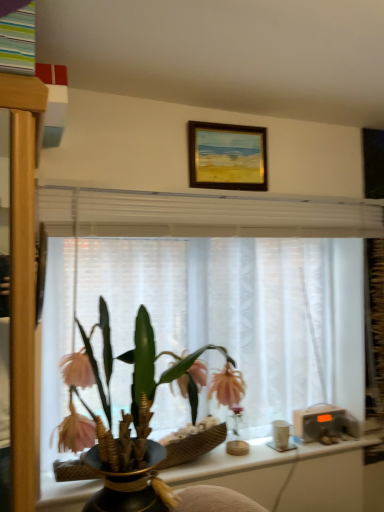
Question: Considering the relative sizes of white matte cup at right and white sheer curtain at center in the image provided, is white matte cup at right smaller than white sheer curtain at center?

Choices:
 (A) yes
 (B) no

Answer: (A)

Question: Could you tell me if white matte cup at right is turned towards white sheer curtain at center?

Choices:
 (A) no
 (B) yes

Answer: (A)

Question: Would you say white matte cup at right is outside white sheer curtain at center?

Choices:
 (A) yes
 (B) no

Answer: (A)

Question: From a real-world perspective, does white matte cup at right stand above white sheer curtain at center?

Choices:
 (A) no
 (B) yes

Answer: (A)

Question: Can you confirm if white matte cup at right is positioned to the left of white sheer curtain at center?

Choices:
 (A) yes
 (B) no

Answer: (B)

Question: Based on their positions, is transparent glass vase at center located to the left or right of matte black vase at center?

Choices:
 (A) left
 (B) right

Answer: (B)

Question: Is transparent glass vase at center spatially inside matte black vase at center, or outside of it?

Choices:
 (A) inside
 (B) outside

Answer: (B)

Question: Considering the positions of transparent glass vase at center and matte black vase at center in the image, is transparent glass vase at center wider or thinner than matte black vase at center?

Choices:
 (A) thin
 (B) wide

Answer: (A)

Question: Relative to matte black vase at center, is transparent glass vase at center in front or behind?

Choices:
 (A) front
 (B) behind

Answer: (B)

Question: Is point (188, 132) positioned closer to the camera than point (284, 438)?

Choices:
 (A) farther
 (B) closer

Answer: (B)

Question: Is gold-framed painting at upper center wider or thinner than white matte cup at right?

Choices:
 (A) thin
 (B) wide

Answer: (A)

Question: Is gold-framed painting at upper center spatially inside white matte cup at right, or outside of it?

Choices:
 (A) inside
 (B) outside

Answer: (B)

Question: From a real-world perspective, is gold-framed painting at upper center physically located above or below white matte cup at right?

Choices:
 (A) below
 (B) above

Answer: (B)

Question: In the image, is transparent glass vase at center on the left side or the right side of white matte cup at right?

Choices:
 (A) left
 (B) right

Answer: (A)

Question: In terms of width, does transparent glass vase at center look wider or thinner when compared to white matte cup at right?

Choices:
 (A) wide
 (B) thin

Answer: (A)